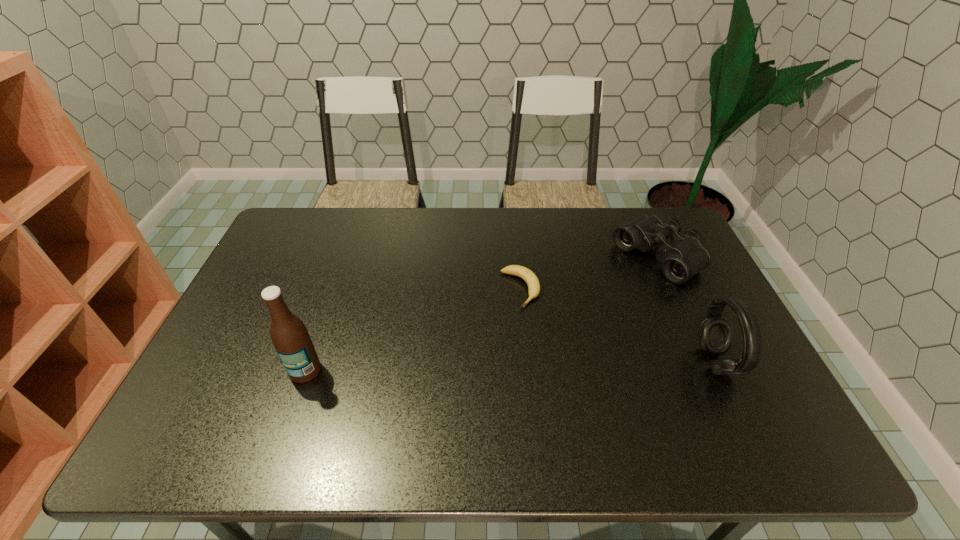
Image resolution: width=960 pixels, height=540 pixels. What are the coordinates of `the leftmost object` in the screenshot? It's located at (292, 342).

Find the location of a particular element. This screenshot has height=540, width=960. beer bottle is located at coordinates (292, 342).

The width and height of the screenshot is (960, 540). I want to click on headset, so click(715, 333).

Where is `banana`? The width and height of the screenshot is (960, 540). banana is located at coordinates (527, 275).

What are the coordinates of `the third object from right to left` in the screenshot? It's located at (527, 275).

This screenshot has width=960, height=540. What are the coordinates of `the third tallest object` in the screenshot? It's located at (685, 256).

Locate an element on the screen. Image resolution: width=960 pixels, height=540 pixels. vacant area situated on the back of the tallest object is located at coordinates (319, 330).

The width and height of the screenshot is (960, 540). Identify the location of free space located 0.050m on the earcups of the headset. (750, 362).

Where is `vacant area situated at the stem of the banana`? This screenshot has height=540, width=960. vacant area situated at the stem of the banana is located at coordinates (575, 372).

At what (x,y) coordinates should I click in order to perform the action: click on free space located 0.110m at the stem of the banana. Please return your answer as a coordinate pair (x, y). Looking at the image, I should click on (549, 335).